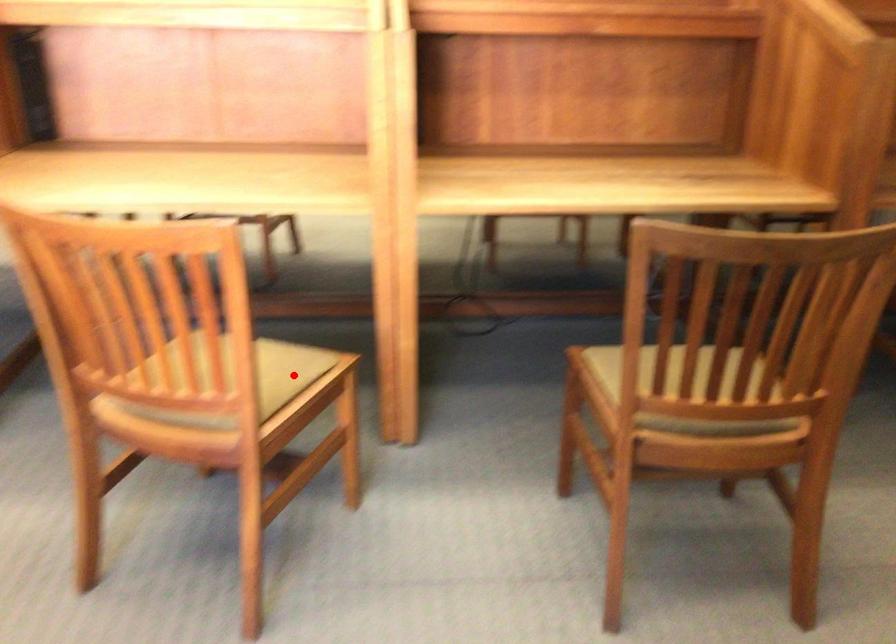
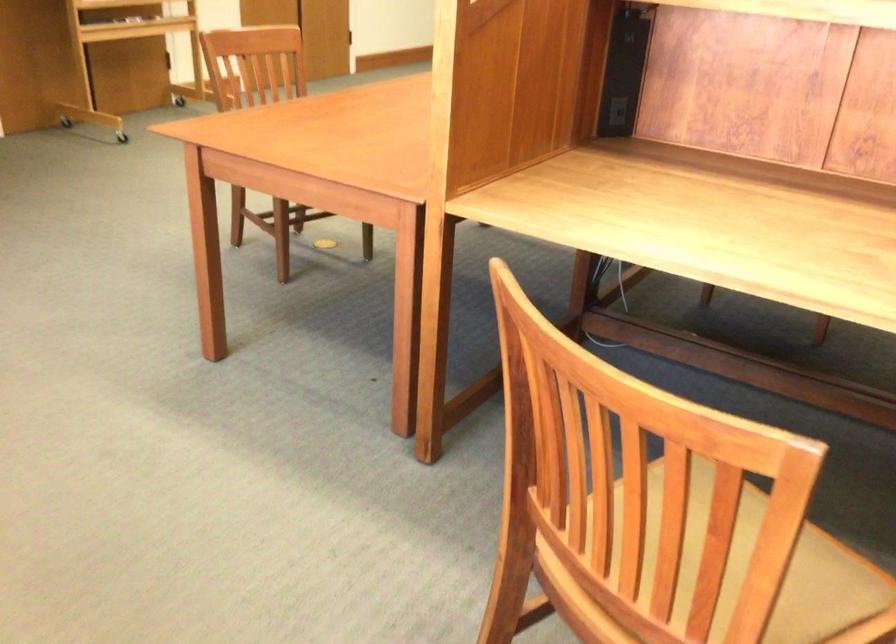
Locate, in the second image, the point that corresponds to the highlighted location in the first image.

(833, 594)